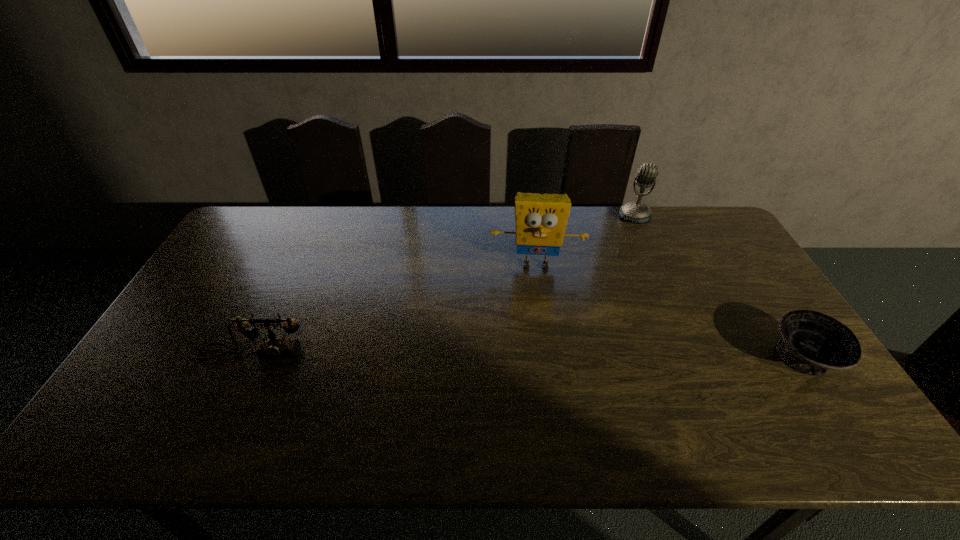
Image resolution: width=960 pixels, height=540 pixels. In order to click on free region located 0.330m on the face of the second farthest object in this screenshot , I will do `click(537, 364)`.

The height and width of the screenshot is (540, 960). I want to click on vacant space located on the face of the second farthest object, so click(x=537, y=368).

You are a GUI agent. You are given a task and a screenshot of the screen. Output one action in this format:
    pyautogui.click(x=<x>, y=<y>)
    Task: Click on the free spot located 0.390m on the face of the second farthest object
    The image size is (960, 540).
    Given the screenshot: What is the action you would take?
    pyautogui.click(x=538, y=384)

Locate an element on the screen. blank space located on the front-facing side of the microphone is located at coordinates (617, 259).

This screenshot has width=960, height=540. In order to click on vacant space located on the front-facing side of the microphone in this screenshot , I will do `click(623, 244)`.

Identify the location of vacant space located on the front-facing side of the microphone. This screenshot has height=540, width=960. (616, 260).

Locate an element on the screen. The height and width of the screenshot is (540, 960). object that is at the far edge is located at coordinates (637, 212).

Where is `object located at the near edge`? This screenshot has width=960, height=540. object located at the near edge is located at coordinates (812, 343).

Where is `object that is at the left edge`? object that is at the left edge is located at coordinates (275, 347).

You are a GUI agent. You are given a task and a screenshot of the screen. Output one action in this format:
    pyautogui.click(x=<x>, y=<y>)
    Task: Click on the object present at the right edge
    The width and height of the screenshot is (960, 540).
    Given the screenshot: What is the action you would take?
    pyautogui.click(x=812, y=343)